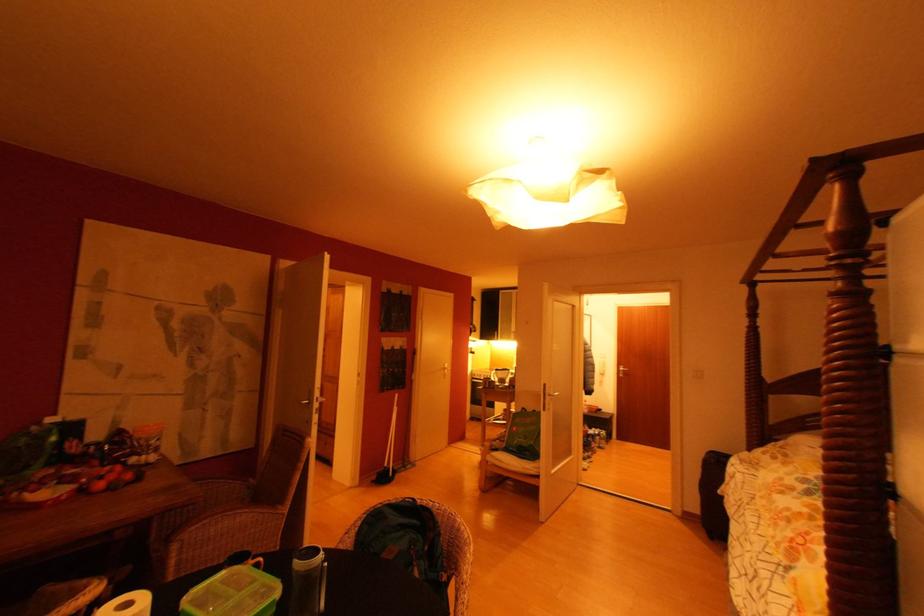
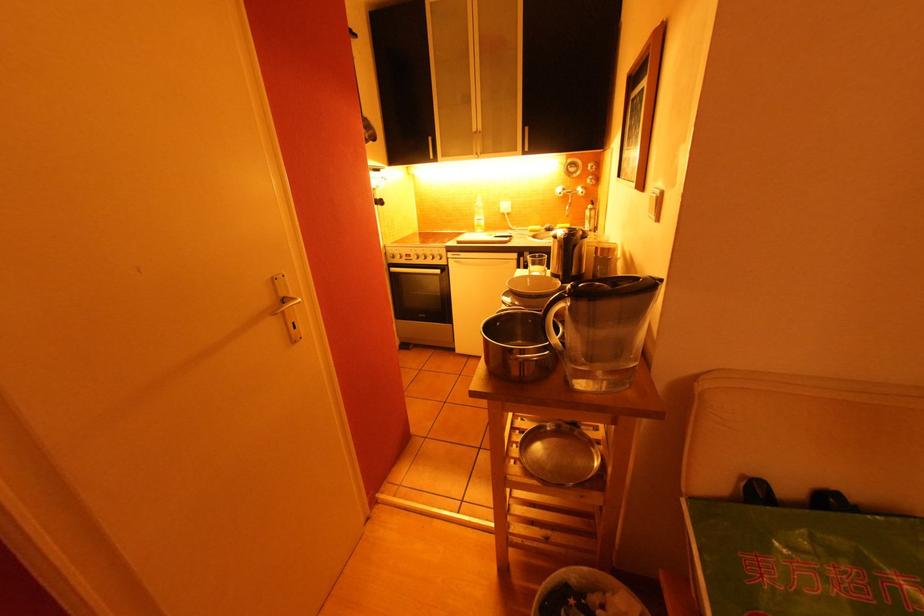
In the second image, find the point that corresponds to (x=479, y=377) in the first image.

(398, 259)